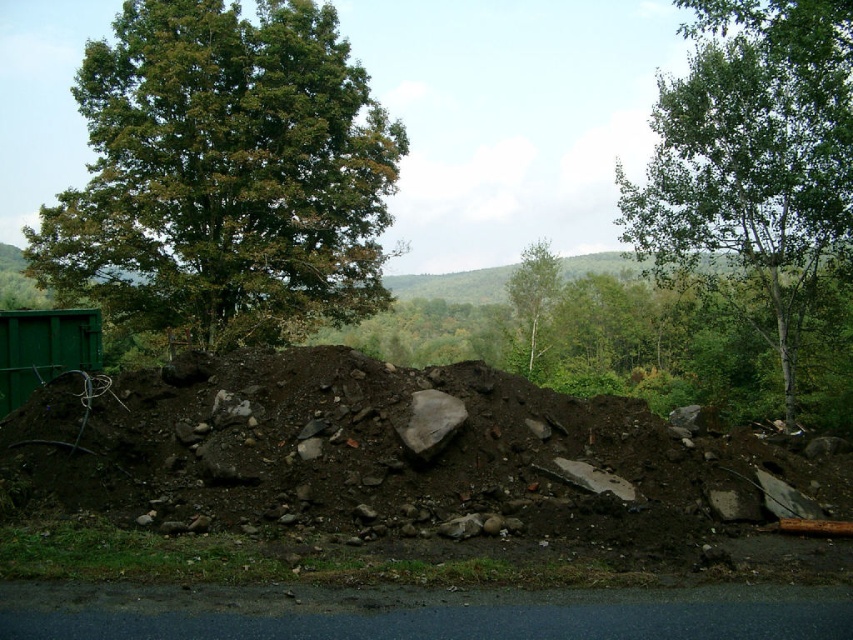
You are standing at the edge of the road looking at the pile of dirt and debris. There are two points marked on the pile. Which point is closer to you, point (312, 259) or point (518, 292)?

Point (312, 259) is closer to the viewer than point (518, 292).

You are standing at the edge of the road looking at the large pile of dirt and debris. There is a point marked at coordinates (390, 477). What does this point represent?

The point at coordinates (390, 477) marks brown dry soil at center.